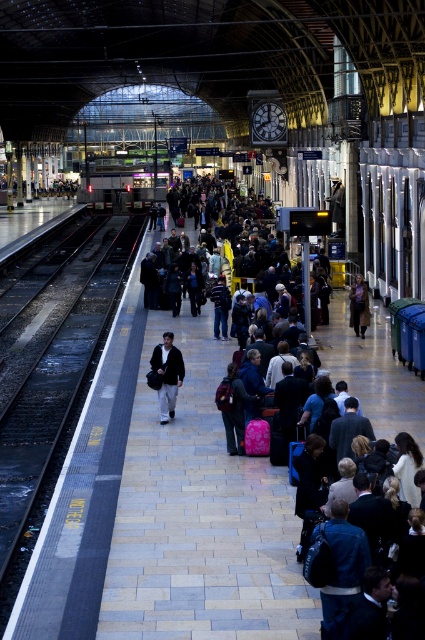
From the picture: Does black asphalt train track at left lie in front of dark gray sweater at center?

Yes, black asphalt train track at left is closer to the viewer.

Is black asphalt train track at left to the left of dark gray sweater at center from the viewer's perspective?

Indeed, black asphalt train track at left is positioned on the left side of dark gray sweater at center.

Where is `black asphalt train track at left`? The height and width of the screenshot is (640, 425). black asphalt train track at left is located at coordinates (61, 396).

Identify the location of black asphalt train track at left. (61, 396).

Is point (408, 392) positioned behind point (30, 460)?

That is True.

Between dark gray fabric crowd at center and black asphalt train track at left, which one has less height?

dark gray fabric crowd at center

Is point (285, 586) farther from viewer compared to point (25, 477)?

No, (285, 586) is in front of (25, 477).

At what (x,y) coordinates should I click in order to perform the action: click on dark gray fabric crowd at center. Please return your answer as a coordinate pair (x, y). Looking at the image, I should click on (201, 516).

Does metallic silver train at center have a greater width compared to dark brown leather jacket at center?

Correct, the width of metallic silver train at center exceeds that of dark brown leather jacket at center.

Is metallic silver train at center further to camera compared to dark brown leather jacket at center?

Yes, it is behind dark brown leather jacket at center.

The image size is (425, 640). What do you see at coordinates (124, 184) in the screenshot? I see `metallic silver train at center` at bounding box center [124, 184].

The image size is (425, 640). Find the location of `metallic silver train at center`. metallic silver train at center is located at coordinates (124, 184).